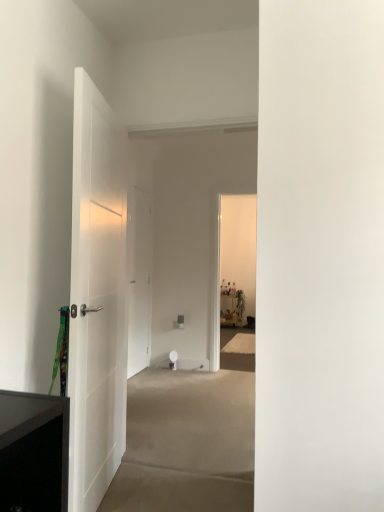
Describe the element at coordinates (138, 279) in the screenshot. The image size is (384, 512). I see `white matte door at center, acting as the second door starting from the front` at that location.

Measure the distance between white matte door at center, which ranks as the first door in back-to-front order, and camera.

white matte door at center, which ranks as the first door in back-to-front order, and camera are 4.36 meters apart from each other.

This screenshot has height=512, width=384. In order to click on white matte door at center, acting as the second door starting from the front in this screenshot , I will do click(138, 279).

Describe the element at coordinates (96, 298) in the screenshot. I see `white matte door at left, arranged as the first door when viewed from the front` at that location.

This screenshot has width=384, height=512. Find the location of `white matte door at left, arranged as the first door when viewed from the front`. white matte door at left, arranged as the first door when viewed from the front is located at coordinates (96, 298).

In order to face white matte door at left, the second door viewed from the back, should I rotate leftwards or rightwards?

You should look left and rotate roughly 11.560 degrees.

You are a GUI agent. You are given a task and a screenshot of the screen. Output one action in this format:
    pyautogui.click(x=<x>, y=<y>)
    Task: Click on the white matte door at center, which ranks as the first door in back-to-front order
    This screenshot has height=512, width=384.
    Given the screenshot: What is the action you would take?
    pyautogui.click(x=138, y=279)

Can you confirm if white matte door at center, which ranks as the first door in back-to-front order, is positioned to the right of white matte door at left, arranged as the first door when viewed from the front?

Incorrect, white matte door at center, which ranks as the first door in back-to-front order, is not on the right side of white matte door at left, arranged as the first door when viewed from the front.

Which is behind, white matte door at center, acting as the second door starting from the front, or white matte door at left, arranged as the first door when viewed from the front?

white matte door at center, acting as the second door starting from the front.

Does point (134, 245) lie in front of point (85, 470)?

No, (134, 245) is behind (85, 470).

From the image's perspective, is white matte door at center, acting as the second door starting from the front, above or below white matte door at left, arranged as the first door when viewed from the front?

white matte door at center, acting as the second door starting from the front, is below white matte door at left, arranged as the first door when viewed from the front.

From a real-world perspective, is white matte door at center, which ranks as the first door in back-to-front order, positioned above or below white matte door at left, the second door viewed from the back?

white matte door at center, which ranks as the first door in back-to-front order, is above white matte door at left, the second door viewed from the back.

Considering the relative sizes of white matte door at center, which ranks as the first door in back-to-front order, and white matte door at left, arranged as the first door when viewed from the front, in the image provided, is white matte door at center, which ranks as the first door in back-to-front order, wider than white matte door at left, arranged as the first door when viewed from the front,?

No, white matte door at center, which ranks as the first door in back-to-front order, is not wider than white matte door at left, arranged as the first door when viewed from the front.

Considering the relative sizes of white matte door at center, which ranks as the first door in back-to-front order, and white matte door at left, arranged as the first door when viewed from the front, in the image provided, is white matte door at center, which ranks as the first door in back-to-front order, taller than white matte door at left, arranged as the first door when viewed from the front,?

No.

Considering the sizes of white matte door at center, acting as the second door starting from the front, and white matte door at left, the second door viewed from the back, in the image, is white matte door at center, acting as the second door starting from the front, bigger or smaller than white matte door at left, the second door viewed from the back,?

white matte door at center, acting as the second door starting from the front, is smaller than white matte door at left, the second door viewed from the back.

Would you say white matte door at center, acting as the second door starting from the front, is outside white matte door at left, arranged as the first door when viewed from the front?

Yes.

Are white matte door at center, acting as the second door starting from the front, and white matte door at left, the second door viewed from the back, far apart?

Yes, white matte door at center, acting as the second door starting from the front, is far from white matte door at left, the second door viewed from the back.

Could you tell me if white matte door at center, acting as the second door starting from the front, is turned towards white matte door at left, the second door viewed from the back?

No, white matte door at center, acting as the second door starting from the front, does not turn towards white matte door at left, the second door viewed from the back.

What's the angular difference between white matte door at center, acting as the second door starting from the front, and white matte door at left, the second door viewed from the back,'s facing directions?

The angular difference between white matte door at center, acting as the second door starting from the front, and white matte door at left, the second door viewed from the back, is 11.4 degrees.

I want to click on door that is above the white matte door at left, the second door viewed from the back (from a real-world perspective), so click(138, 279).

Is white matte door at left, the second door viewed from the back, to the left of white matte door at center, acting as the second door starting from the front, from the viewer's perspective?

No, white matte door at left, the second door viewed from the back, is not to the left of white matte door at center, acting as the second door starting from the front.

In the image, is white matte door at left, the second door viewed from the back, positioned in front of or behind white matte door at center, which ranks as the first door in back-to-front order?

white matte door at left, the second door viewed from the back, is in front of white matte door at center, which ranks as the first door in back-to-front order.

Which point is more forward, (95, 345) or (141, 209)?

The point (95, 345) is closer to the camera.

From the image's perspective, does white matte door at left, arranged as the first door when viewed from the front, appear higher than white matte door at center, which ranks as the first door in back-to-front order?

Correct, white matte door at left, arranged as the first door when viewed from the front, appears higher than white matte door at center, which ranks as the first door in back-to-front order, in the image.

From a real-world perspective, is white matte door at left, the second door viewed from the back, beneath white matte door at center, which ranks as the first door in back-to-front order?

Correct, in the physical world, white matte door at left, the second door viewed from the back, is lower than white matte door at center, which ranks as the first door in back-to-front order.

Looking at their sizes, would you say white matte door at left, the second door viewed from the back, is wider or thinner than white matte door at center, which ranks as the first door in back-to-front order?

white matte door at left, the second door viewed from the back, is wider than white matte door at center, which ranks as the first door in back-to-front order.

Considering the sizes of white matte door at left, arranged as the first door when viewed from the front, and white matte door at center, acting as the second door starting from the front, in the image, is white matte door at left, arranged as the first door when viewed from the front, taller or shorter than white matte door at center, acting as the second door starting from the front,?

In the image, white matte door at left, arranged as the first door when viewed from the front, appears to be taller than white matte door at center, acting as the second door starting from the front.

Which of these two, white matte door at left, the second door viewed from the back, or white matte door at center, acting as the second door starting from the front, is smaller?

white matte door at center, acting as the second door starting from the front.

Would you say white matte door at left, the second door viewed from the back, is outside white matte door at center, acting as the second door starting from the front?

Yes, white matte door at left, the second door viewed from the back, is outside of white matte door at center, acting as the second door starting from the front.

Looking at this image, is white matte door at left, arranged as the first door when viewed from the front, not close to white matte door at center, which ranks as the first door in back-to-front order?

That's right, there is a large distance between white matte door at left, arranged as the first door when viewed from the front, and white matte door at center, which ranks as the first door in back-to-front order.

Could you tell me if white matte door at left, arranged as the first door when viewed from the front, is facing white matte door at center, acting as the second door starting from the front?

No, white matte door at left, arranged as the first door when viewed from the front, is not facing towards white matte door at center, acting as the second door starting from the front.

This screenshot has width=384, height=512. Identify the location of door above the white matte door at center, acting as the second door starting from the front (from the image's perspective). click(96, 298).

Where is `door above the white matte door at center, acting as the second door starting from the front (from the image's perspective)`? This screenshot has height=512, width=384. door above the white matte door at center, acting as the second door starting from the front (from the image's perspective) is located at coordinates (96, 298).

Where is `door in front of the white matte door at center, which ranks as the first door in back-to-front order`? door in front of the white matte door at center, which ranks as the first door in back-to-front order is located at coordinates (96, 298).